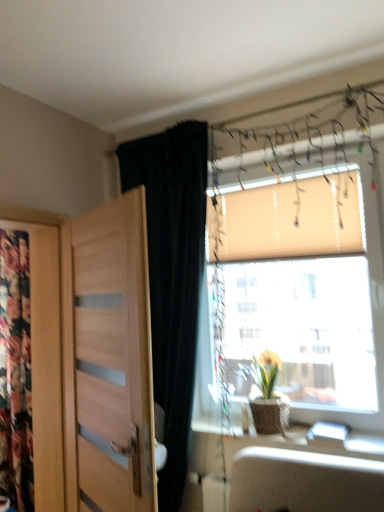
You are a GUI agent. You are given a task and a screenshot of the screen. Output one action in this format:
    pyautogui.click(x=<x>, y=<y>)
    Task: Click on the free spot above wooden blinds at upper right (from a real-world perspective)
    Image resolution: width=384 pixels, height=512 pixels.
    Given the screenshot: What is the action you would take?
    pyautogui.click(x=271, y=157)